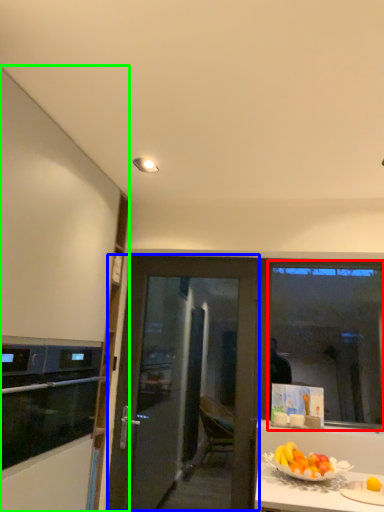
Question: Which object is positioned closest to window screen (highlighted by a red box)? Select from door (highlighted by a blue box) and cabinetry (highlighted by a green box).

Choices:
 (A) door
 (B) cabinetry

Answer: (A)